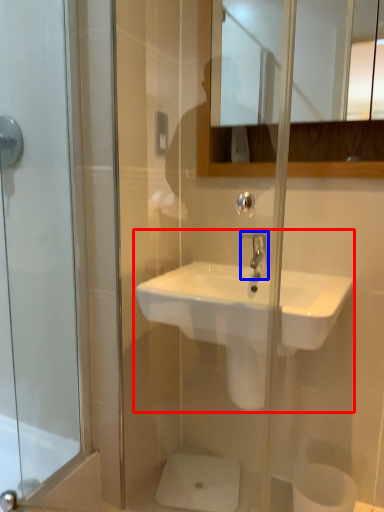
Question: Which object is closer to the camera taking this photo, sink (highlighted by a red box) or tap (highlighted by a blue box)?

Choices:
 (A) sink
 (B) tap

Answer: (A)